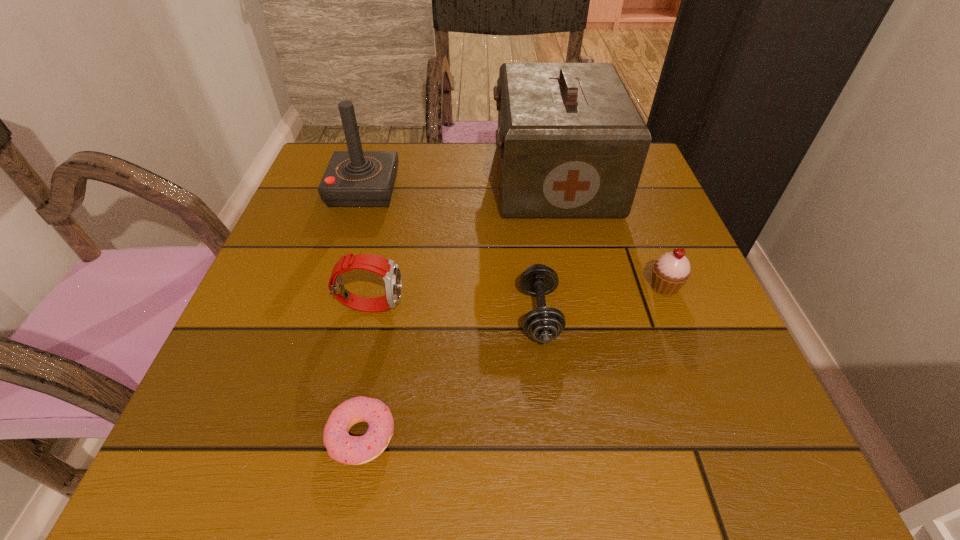
Identify the location of vacant space located 0.260m on the left of the cupcake. This screenshot has height=540, width=960. (505, 287).

Find the location of a particular element. free spot located on the front of the dumbbell is located at coordinates (549, 400).

Locate an element on the screen. free location located on the right of the doughnut is located at coordinates (626, 436).

At what (x,y) coordinates should I click in order to perform the action: click on the first-aid kit that is at the far edge. Please return your answer as a coordinate pair (x, y). The width and height of the screenshot is (960, 540). Looking at the image, I should click on (572, 144).

Where is `joystick located at the far edge`? The width and height of the screenshot is (960, 540). joystick located at the far edge is located at coordinates (355, 178).

The width and height of the screenshot is (960, 540). Identify the location of object situated at the near edge. (354, 450).

The width and height of the screenshot is (960, 540). I want to click on joystick that is positioned at the left edge, so point(355,178).

The image size is (960, 540). I want to click on watch present at the left edge, so click(388, 269).

The height and width of the screenshot is (540, 960). What are the coordinates of `the first-aid kit located in the right edge section of the desktop` in the screenshot? It's located at (572, 144).

Find the location of `cupcake that is at the right edge`. cupcake that is at the right edge is located at coordinates (670, 272).